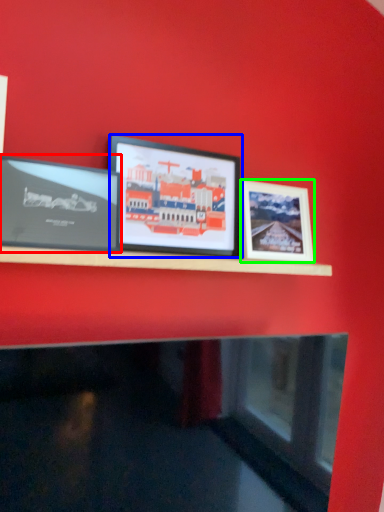
Question: Estimate the real-world distances between objects in this image. Which object is farther from picture frame (highlighted by a red box), picture frame (highlighted by a blue box) or picture frame (highlighted by a green box)?

Choices:
 (A) picture frame
 (B) picture frame

Answer: (B)